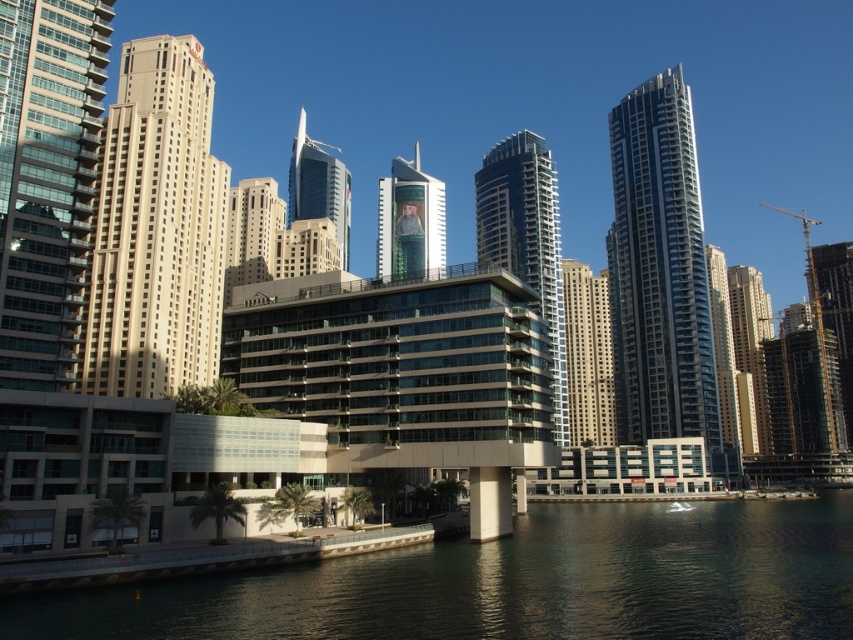
Is matte glass building at left positioned before glassy steel skyscraper at center right?

Yes, it is in front of glassy steel skyscraper at center right.

Between point (45, 385) and point (646, 269), which one is positioned behind?

Point (646, 269)

Measure the distance between point (94,116) and camera.

Point (94,116) is 241.24 feet away from camera.

Where is `matte glass building at left`? The height and width of the screenshot is (640, 853). matte glass building at left is located at coordinates (48, 184).

Which is below, greenish reflective water at lower center or smooth beige building at right?

Positioned lower is greenish reflective water at lower center.

Who is taller, greenish reflective water at lower center or smooth beige building at right?

Standing taller between the two is smooth beige building at right.

Locate an element on the screen. This screenshot has height=640, width=853. greenish reflective water at lower center is located at coordinates (515, 582).

Does beige concrete building at left appear on the left side of glassy blue skyscraper at center?

Indeed, beige concrete building at left is positioned on the left side of glassy blue skyscraper at center.

Which of these two, beige concrete building at left or glassy blue skyscraper at center, stands shorter?

With less height is beige concrete building at left.

Describe the element at coordinates (155, 228) in the screenshot. I see `beige concrete building at left` at that location.

Where is `beige concrete building at left`? beige concrete building at left is located at coordinates (155, 228).